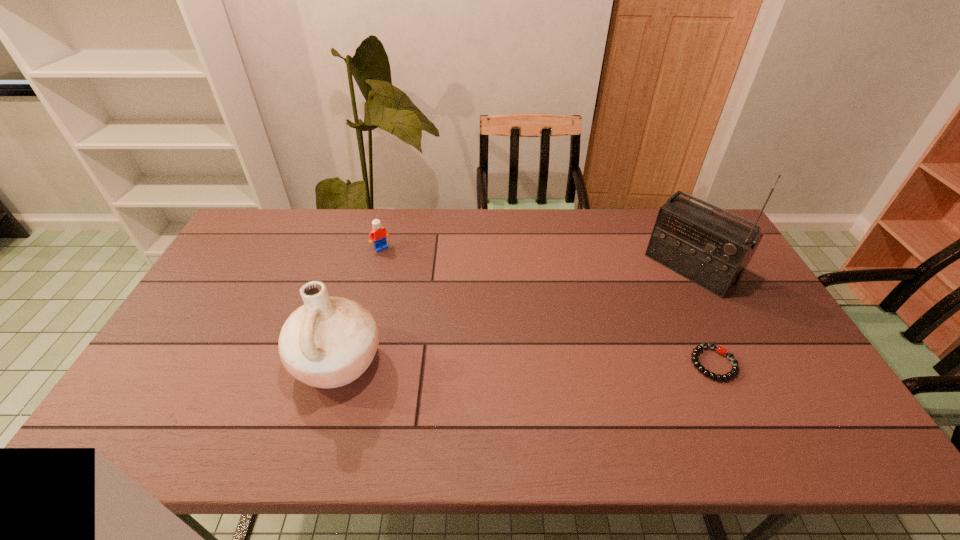
What are the coordinates of `blank space located on the face of the Lego` in the screenshot? It's located at (425, 295).

Locate an element on the screen. vacant area situated on the front panel of the tallest object is located at coordinates (634, 319).

This screenshot has width=960, height=540. I want to click on blank space located on the front panel of the tallest object, so click(x=651, y=303).

You are a GUI agent. You are given a task and a screenshot of the screen. Output one action in this format:
    pyautogui.click(x=<x>, y=<y>)
    Task: Click on the vacant region located 0.100m on the front panel of the tallest object
    Image resolution: width=960 pixels, height=540 pixels.
    Given the screenshot: What is the action you would take?
    pyautogui.click(x=651, y=303)

Where is `Lego that is positioned at the far edge`? The width and height of the screenshot is (960, 540). Lego that is positioned at the far edge is located at coordinates (379, 234).

This screenshot has height=540, width=960. I want to click on radio receiver that is at the far edge, so click(x=713, y=251).

Locate an element on the screen. pottery that is at the near edge is located at coordinates (328, 342).

Identify the location of bracelet at the near edge. (695, 354).

The image size is (960, 540). I want to click on object that is at the right edge, so click(713, 251).

I want to click on object present at the far right corner, so click(x=713, y=251).